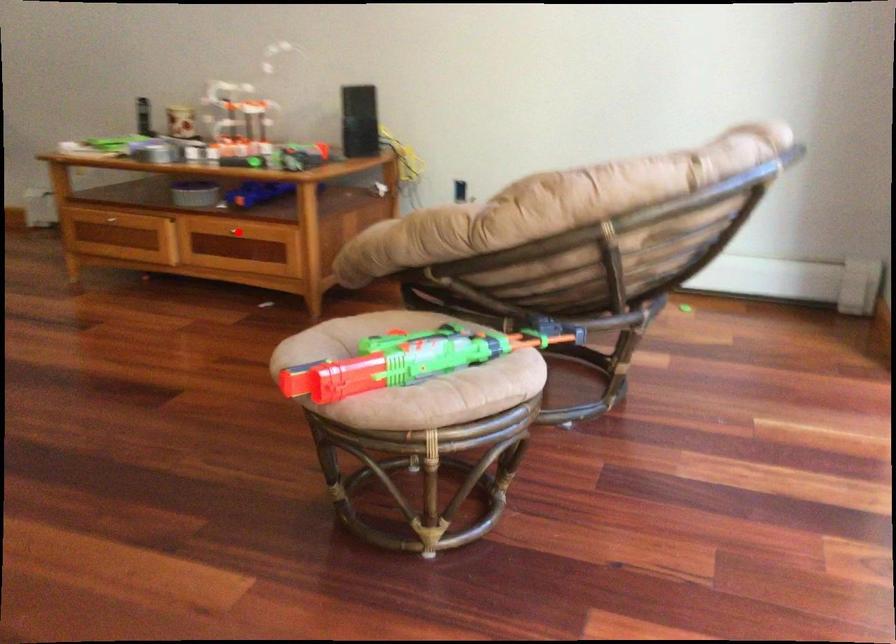
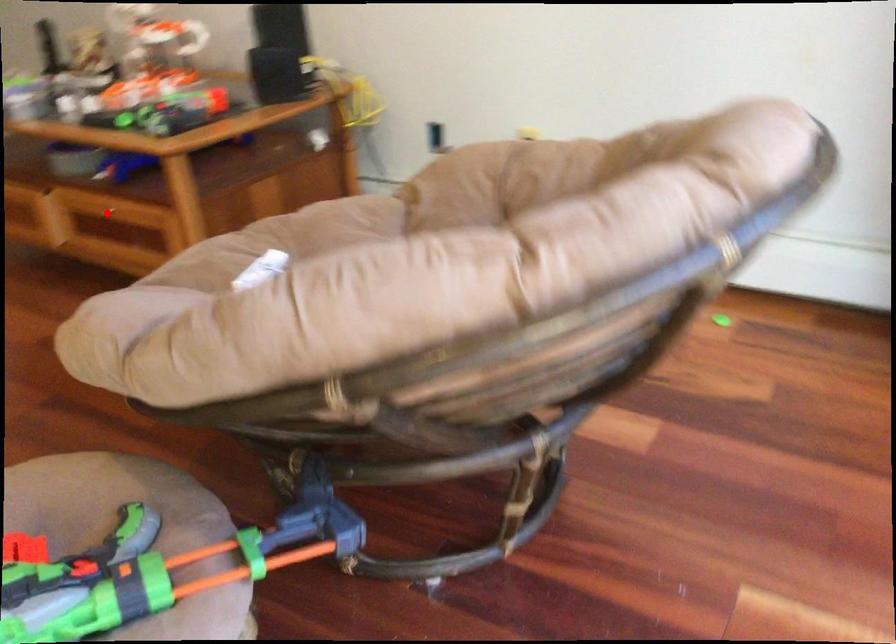
I am providing you with two images of the same scene from different viewpoints. A red point is marked on the first image and another point is marked on the second image. Is the red point in image1 aligned with the point shown in image2?

Yes